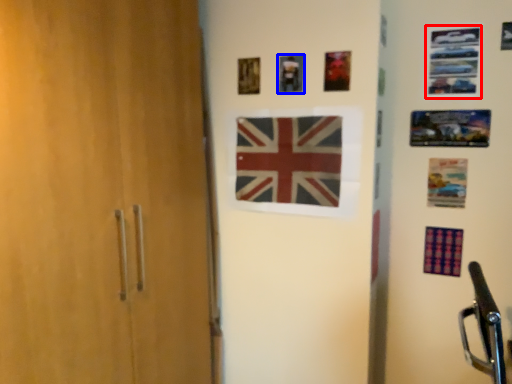
Question: Which object appears farthest to the camera in this image, picture frame (highlighted by a red box) or picture frame (highlighted by a blue box)?

Choices:
 (A) picture frame
 (B) picture frame

Answer: (B)